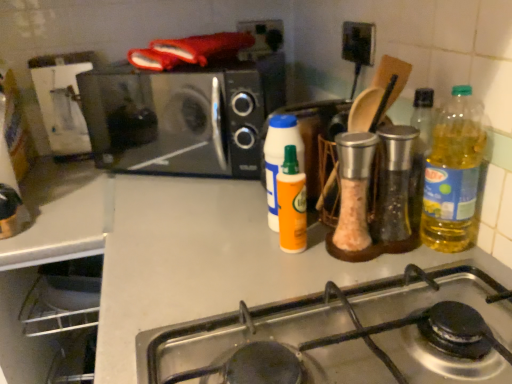
Locate an element on the screen. The height and width of the screenshot is (384, 512). free spot to the left of orange matte bottle at center, which appears as the 4th bottle when viewed from the right is located at coordinates (198, 231).